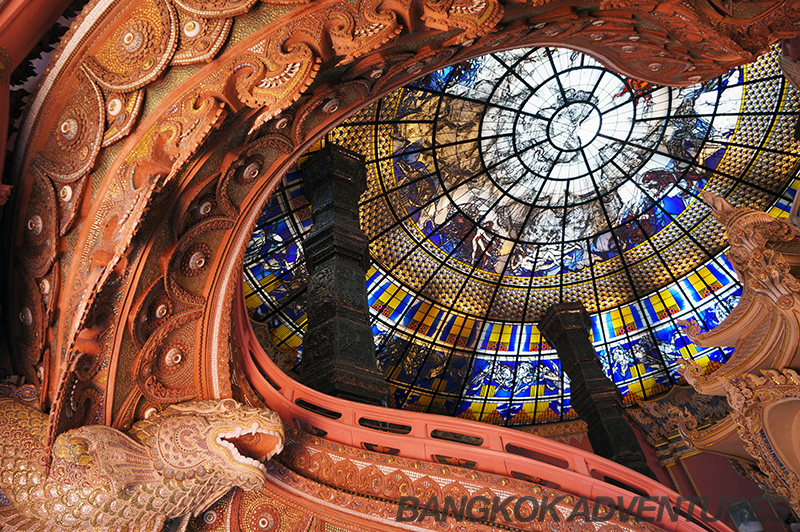
Where is `orange stained glass`? orange stained glass is located at coordinates (633, 83).